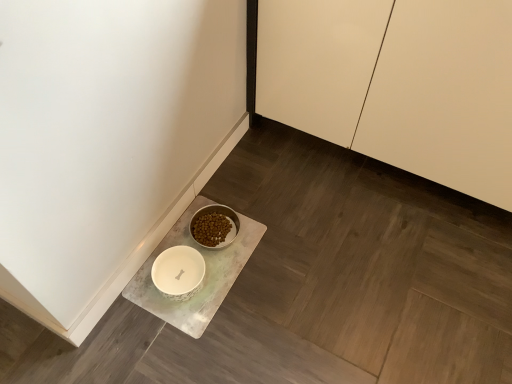
The height and width of the screenshot is (384, 512). What are the coordinates of `white marble tray at lower left` in the screenshot? It's located at (203, 279).

What do you see at coordinates (203, 279) in the screenshot? I see `white marble tray at lower left` at bounding box center [203, 279].

What is the approximate width of white glossy cabinet at upper right?

white glossy cabinet at upper right is 64.73 centimeters in width.

The height and width of the screenshot is (384, 512). I want to click on white glossy cabinet at upper right, so click(398, 83).

Describe the element at coordinates (398, 83) in the screenshot. The width and height of the screenshot is (512, 384). I see `white glossy cabinet at upper right` at that location.

Locate an element on the screen. white marble tray at lower left is located at coordinates (203, 279).

Is white glossy cabinet at upper right to the left or to the right of white marble tray at lower left in the image?

Based on their positions, white glossy cabinet at upper right is located to the right of white marble tray at lower left.

Which object is closer to the camera taking this photo, white glossy cabinet at upper right or white marble tray at lower left?

white glossy cabinet at upper right.

Considering the positions of points (480, 101) and (184, 326), is point (480, 101) farther from camera compared to point (184, 326)?

No, it is in front of (184, 326).

From the image's perspective, is white glossy cabinet at upper right below white marble tray at lower left?

No, from the image's perspective, white glossy cabinet at upper right is not beneath white marble tray at lower left.

From a real-world perspective, is white glossy cabinet at upper right positioned above or below white marble tray at lower left?

Clearly, from a real-world perspective, white glossy cabinet at upper right is above white marble tray at lower left.

Can you confirm if white glossy cabinet at upper right is wider than white marble tray at lower left?

Yes, white glossy cabinet at upper right is wider than white marble tray at lower left.

Between white glossy cabinet at upper right and white marble tray at lower left, which one has less height?

white marble tray at lower left.

Is white glossy cabinet at upper right bigger than white marble tray at lower left?

Yes, white glossy cabinet at upper right is bigger than white marble tray at lower left.

Is white marble tray at lower left surrounded by white glossy cabinet at upper right?

That's incorrect, white marble tray at lower left is not inside white glossy cabinet at upper right.

Is white glossy cabinet at upper right next to white marble tray at lower left?

There is a gap between white glossy cabinet at upper right and white marble tray at lower left.

Is white glossy cabinet at upper right facing away from white marble tray at lower left?

No.

Based on the photo, can you tell me how much white glossy cabinet at upper right and white marble tray at lower left differ in facing direction?

The angle between the facing direction of white glossy cabinet at upper right and the facing direction of white marble tray at lower left is 90.3 degrees.

This screenshot has height=384, width=512. I want to click on counter below the white glossy cabinet at upper right (from a real-world perspective), so click(x=203, y=279).

Which object is positioned more to the right, white marble tray at lower left or white glossy cabinet at upper right?

Positioned to the right is white glossy cabinet at upper right.

Relative to white glossy cabinet at upper right, is white marble tray at lower left in front or behind?

white marble tray at lower left is behind white glossy cabinet at upper right.

Between point (216, 278) and point (375, 57), which one is positioned in front?

The point (375, 57) is closer.

From the image's perspective, relative to white glossy cabinet at upper right, is white marble tray at lower left above or below?

Clearly, from the image's perspective, white marble tray at lower left is below white glossy cabinet at upper right.

From a real-world perspective, is white marble tray at lower left positioned above or below white glossy cabinet at upper right?

In terms of real-world spatial position, white marble tray at lower left is below white glossy cabinet at upper right.

Which of these two, white marble tray at lower left or white glossy cabinet at upper right, is wider?

With larger width is white glossy cabinet at upper right.

Between white marble tray at lower left and white glossy cabinet at upper right, which one has more height?

white glossy cabinet at upper right is taller.

Between white marble tray at lower left and white glossy cabinet at upper right, which one has larger size?

Bigger between the two is white glossy cabinet at upper right.

Based on the photo, would you say white glossy cabinet at upper right is part of white marble tray at lower left's contents?

No, white glossy cabinet at upper right is not a part of white marble tray at lower left.

Is white marble tray at lower left not near white glossy cabinet at upper right?

No, there isn't a large distance between white marble tray at lower left and white glossy cabinet at upper right.

Could you tell me if white marble tray at lower left is turned towards white glossy cabinet at upper right?

No, white marble tray at lower left is not turned towards white glossy cabinet at upper right.

Can you tell me how much white marble tray at lower left and white glossy cabinet at upper right differ in facing direction?

The angle between the facing direction of white marble tray at lower left and the facing direction of white glossy cabinet at upper right is 90.3 degrees.

The width and height of the screenshot is (512, 384). What are the coordinates of `cabinetry on the right of white marble tray at lower left` in the screenshot? It's located at (398, 83).

At what (x,y) coordinates should I click in order to perform the action: click on counter below the white glossy cabinet at upper right (from a real-world perspective). Please return your answer as a coordinate pair (x, y). Looking at the image, I should click on (203, 279).

What are the coordinates of `counter on the left side of white glossy cabinet at upper right` in the screenshot? It's located at (203, 279).